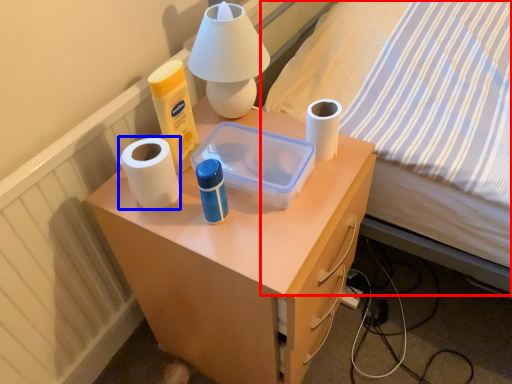
Question: Which of the following is the closest to the observer, bed (highlighted by a red box) or paper towel (highlighted by a blue box)?

Choices:
 (A) bed
 (B) paper towel

Answer: (A)